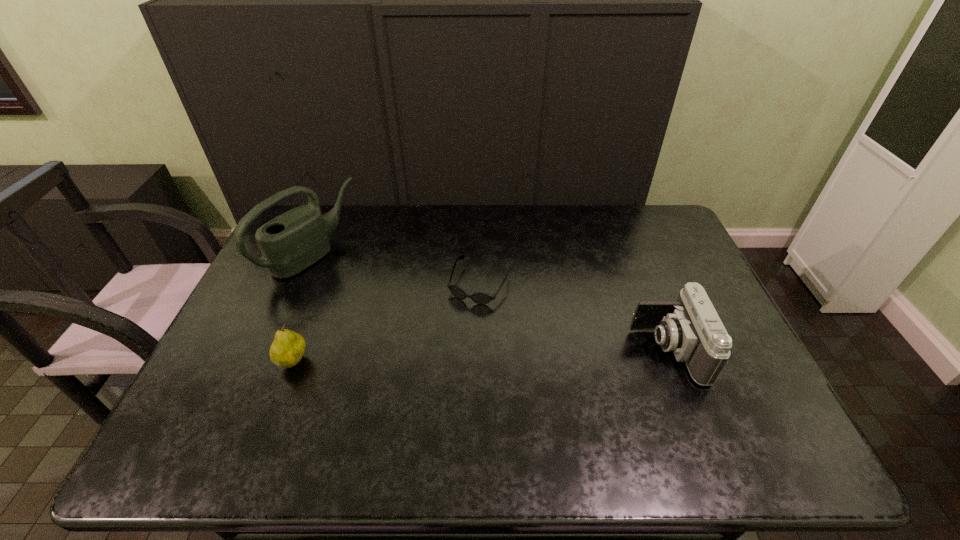
I want to click on vacant position located 0.370m on the spout of the tallest object, so click(x=425, y=328).

You are a GUI agent. You are given a task and a screenshot of the screen. Output one action in this format:
    pyautogui.click(x=<x>, y=<y>)
    Task: Click on the vacant space located on the spout of the tallest object
    
    Given the screenshot: What is the action you would take?
    pyautogui.click(x=382, y=302)

Where is `vacant region located on the lenses of the third object from left to right`? vacant region located on the lenses of the third object from left to right is located at coordinates (442, 357).

Image resolution: width=960 pixels, height=540 pixels. I want to click on vacant region located 0.120m on the lenses of the third object from left to right, so click(453, 335).

This screenshot has width=960, height=540. Find the location of `vacant space located 0.290m on the lenses of the third object from left to right`. vacant space located 0.290m on the lenses of the third object from left to right is located at coordinates (427, 385).

This screenshot has width=960, height=540. Identify the location of object at the far edge. (293, 241).

Where is `object located in the near edge section of the desktop`? This screenshot has height=540, width=960. object located in the near edge section of the desktop is located at coordinates (690, 327).

You are a GUI agent. You are given a task and a screenshot of the screen. Output one action in this format:
    pyautogui.click(x=<x>, y=<y>)
    Task: Click on the object situated at the left edge
    Image resolution: width=960 pixels, height=540 pixels.
    Given the screenshot: What is the action you would take?
    point(293,241)

Image resolution: width=960 pixels, height=540 pixels. Find the location of `object at the right edge`. object at the right edge is located at coordinates (690, 327).

You are a GUI agent. You are given a task and a screenshot of the screen. Output one action in this format:
    pyautogui.click(x=<x>, y=<y>)
    Task: Click on the object that is at the far left corner
    Image resolution: width=960 pixels, height=540 pixels.
    Given the screenshot: What is the action you would take?
    pyautogui.click(x=293, y=241)